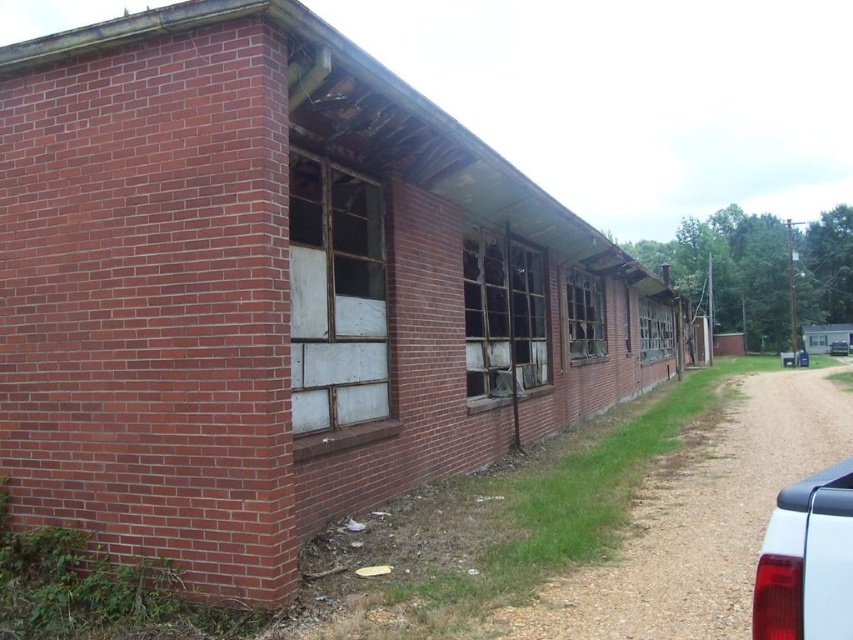
You are standing at the entrance of the old building and need to determine the shortest path to reach the two points marked on the ground. Which point, point (761, 467) or point (824, 496), is closer to you?

Point (761, 467) is closer to you because it is further to the viewer than point (824, 496), meaning it is nearer in the spatial arrangement.

You are standing at the entrance of the old brick building and see two points marked on the wall. The first point is at coordinate point (793, 433) and the second is at point (544, 288). Which point is closer to you?

Point (793, 433) is in front of point (544, 288), so it is closer to you.